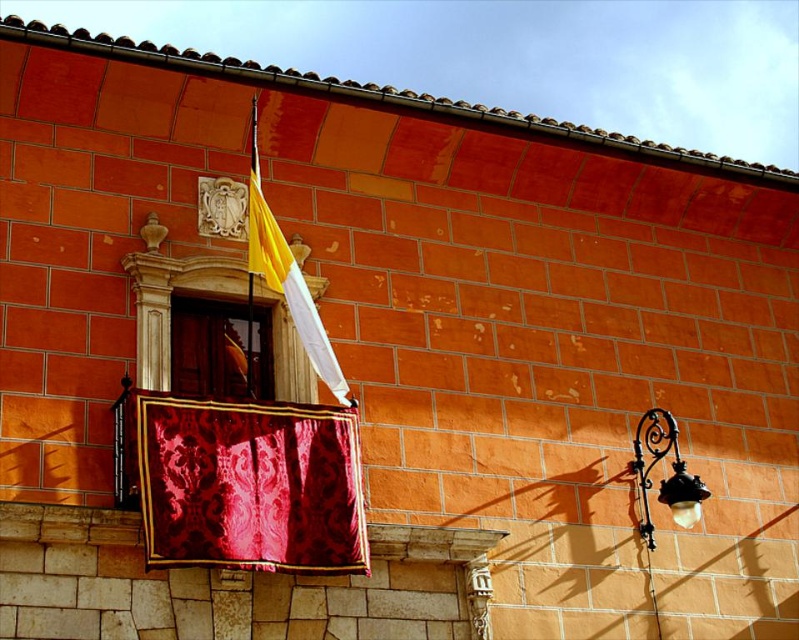
You are a painter standing in front of the building. You want to paint both the velvet damask curtain at center and the wooden door at center. Which object should you focus on first if you want to paint the smaller one first?

The velvet damask curtain at center occupies less space than the wooden door at center, so you should focus on painting the velvet damask curtain at center first.

You are a painter standing at the base of the building. You need to paint both the wooden door at center and the yellow fabric flag at upper center. Which one will you paint first based on their height?

The wooden door at center is shorter than the yellow fabric flag at upper center, so you should paint the wooden door at center first since it is lower and easier to reach before the taller flag.